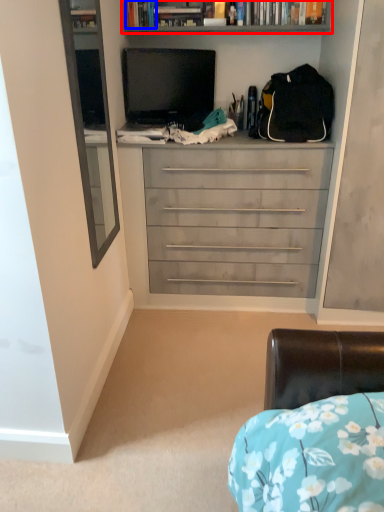
Question: Which point is closer to the camera, bookcase (highlighted by a red box) or book (highlighted by a blue box)?

Choices:
 (A) bookcase
 (B) book

Answer: (A)